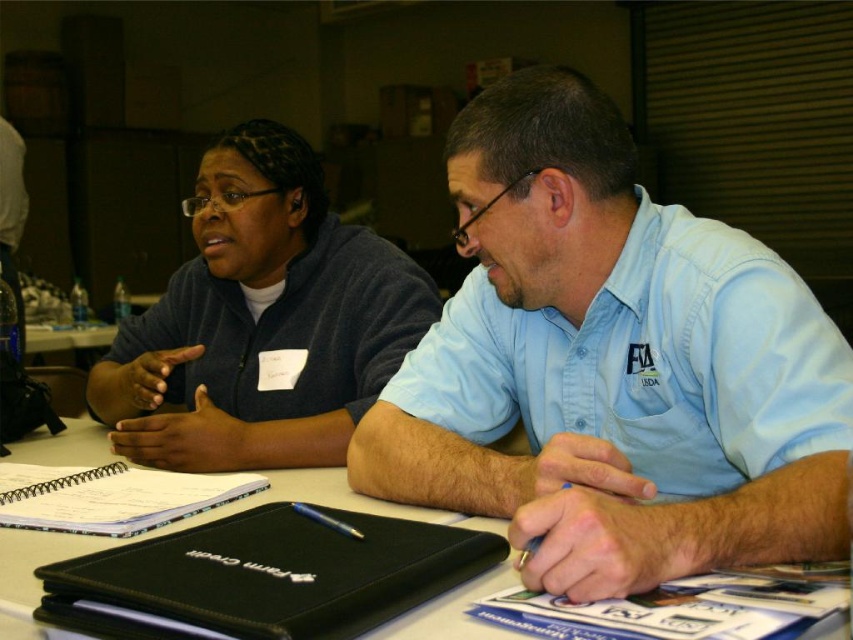
Who is positioned more to the left, dark gray fleece jacket at upper left or black leather notebook at lower center?

From the viewer's perspective, dark gray fleece jacket at upper left appears more on the left side.

Image resolution: width=853 pixels, height=640 pixels. What do you see at coordinates (260, 321) in the screenshot?
I see `dark gray fleece jacket at upper left` at bounding box center [260, 321].

You are a GUI agent. You are given a task and a screenshot of the screen. Output one action in this format:
    pyautogui.click(x=<x>, y=<y>)
    Task: Click on the dark gray fleece jacket at upper left
    Image resolution: width=853 pixels, height=640 pixels.
    Given the screenshot: What is the action you would take?
    pyautogui.click(x=260, y=321)

Can you confirm if white paper at center is wider than spiral-bound paper at center?

Yes.

What do you see at coordinates (184, 528) in the screenshot? I see `white paper at center` at bounding box center [184, 528].

The width and height of the screenshot is (853, 640). I want to click on white paper at center, so click(x=184, y=528).

Is point (641, 340) more distant than point (4, 568)?

That is True.

Does point (671, 234) come in front of point (97, 461)?

That is True.

The image size is (853, 640). Identify the location of light blue denim shirt at center. (611, 365).

Find the location of a particular element. This screenshot has width=853, height=640. light blue denim shirt at center is located at coordinates (611, 365).